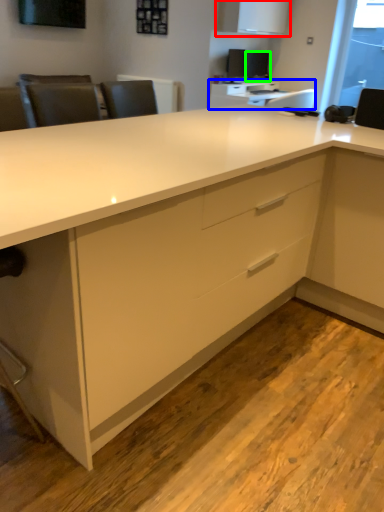
Question: Which object is positioned closest to cabinetry (highlighted by a red box)? Select from table (highlighted by a blue box) and computer monitor (highlighted by a green box).

Choices:
 (A) table
 (B) computer monitor

Answer: (B)